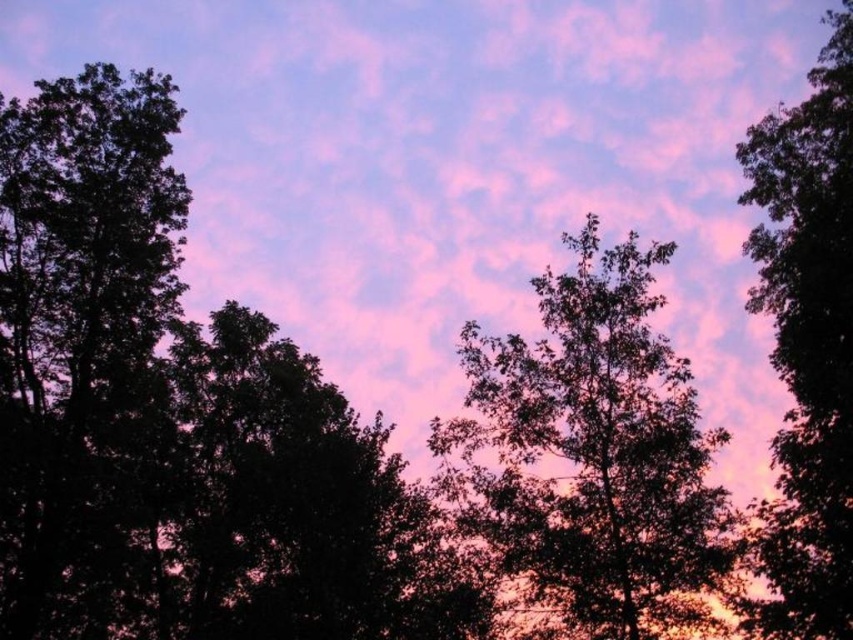
You are an astronomer observing the sky scene. You notice two points in the sky labeled as point [585,634] and point [828,177]. Based on their positions, which point is nearer to your observation point?

Point [585,634] is closer to the viewer than point [828,177], so the astronomer would observe that point [585,634] is nearer to their observation point.

You are standing in a field and see the green leafy tree at center and the silhouette leafy tree at right. Which tree is closer to you?

The green leafy tree at center is closer to you because it is positioned further to the viewer than the silhouette leafy tree at right, meaning it appears nearer in the scene.

You are a landscape architect planning to plant a new tree between the green leafy tree at center and the silhouette leafy tree at right. The new tree must be at least 15 feet away from both existing trees to ensure proper growth. Is there enough space between them to plant the new tree?

The distance between the green leafy tree at center and the silhouette leafy tree at right is 14.75 feet. Since the required minimum spacing is 15 feet, there is not enough space to plant the new tree between them.